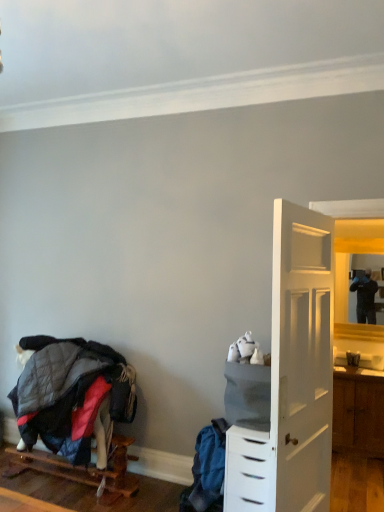
Question: Can you confirm if quilted fabric bunk bed at lower left is smaller than matte wooden mirror at right?

Choices:
 (A) no
 (B) yes

Answer: (A)

Question: Does quilted fabric bunk bed at lower left appear on the left side of matte wooden mirror at right?

Choices:
 (A) yes
 (B) no

Answer: (A)

Question: Is quilted fabric bunk bed at lower left next to matte wooden mirror at right and touching it?

Choices:
 (A) yes
 (B) no

Answer: (B)

Question: Does quilted fabric bunk bed at lower left contain matte wooden mirror at right?

Choices:
 (A) yes
 (B) no

Answer: (B)

Question: Considering the relative positions of quilted fabric bunk bed at lower left and matte wooden mirror at right in the image provided, is quilted fabric bunk bed at lower left to the right of matte wooden mirror at right from the viewer's perspective?

Choices:
 (A) yes
 (B) no

Answer: (B)

Question: Is point (230, 483) positioned closer to the camera than point (44, 453)?

Choices:
 (A) closer
 (B) farther

Answer: (A)

Question: Is white plastic chest of drawers at right wider or thinner than wooden pallet at lower left?

Choices:
 (A) thin
 (B) wide

Answer: (A)

Question: From the image's perspective, relative to wooden pallet at lower left, is white plastic chest of drawers at right above or below?

Choices:
 (A) below
 (B) above

Answer: (B)

Question: Considering the positions of white plastic chest of drawers at right and wooden pallet at lower left in the image, is white plastic chest of drawers at right bigger or smaller than wooden pallet at lower left?

Choices:
 (A) small
 (B) big

Answer: (B)

Question: From their relative heights in the image, would you say wooden pallet at lower left is taller or shorter than matte wooden mirror at right?

Choices:
 (A) tall
 (B) short

Answer: (B)

Question: Considering their positions, is wooden pallet at lower left located in front of or behind matte wooden mirror at right?

Choices:
 (A) front
 (B) behind

Answer: (A)

Question: Looking at their shapes, would you say wooden pallet at lower left is wider or thinner than matte wooden mirror at right?

Choices:
 (A) thin
 (B) wide

Answer: (B)

Question: Which is correct: wooden pallet at lower left is inside matte wooden mirror at right, or outside of it?

Choices:
 (A) inside
 (B) outside

Answer: (B)

Question: Is point (336, 315) positioned closer to the camera than point (127, 483)?

Choices:
 (A) closer
 (B) farther

Answer: (B)

Question: From the image's perspective, relative to wooden pallet at lower left, is matte wooden mirror at right above or below?

Choices:
 (A) above
 (B) below

Answer: (A)